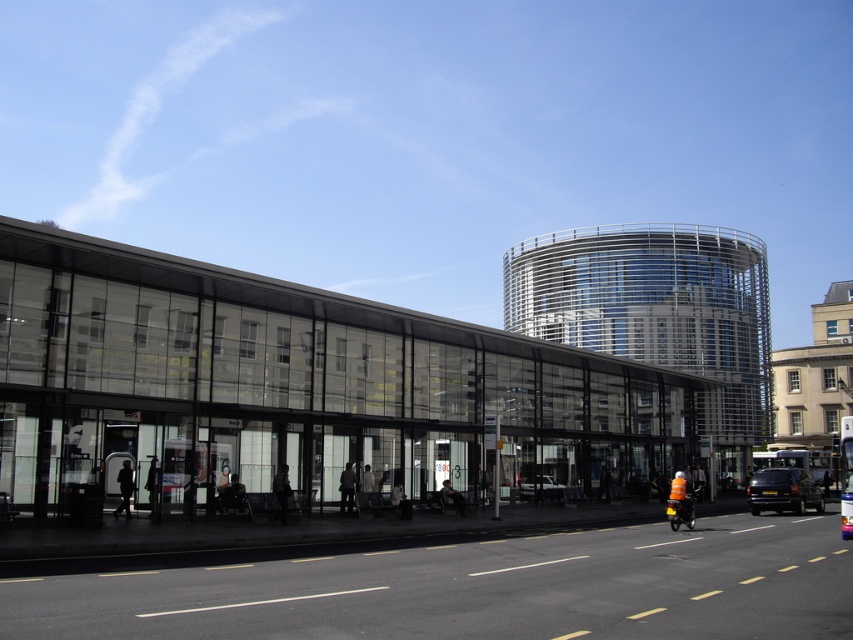
Question: Among these objects, which one is nearest to the camera?

Choices:
 (A) dark gray metallic car at center-right
 (B) white glossy car at center

Answer: (A)

Question: Observing the image, what is the correct spatial positioning of dark gray metallic car at center-right in reference to white glossy car at center?

Choices:
 (A) above
 (B) below

Answer: (B)

Question: Which of the following is the closest to the observer?

Choices:
 (A) (x=120, y=278)
 (B) (x=546, y=499)

Answer: (A)

Question: Which point is farther to the camera?

Choices:
 (A) blue metallic bus at center
 (B) dark gray metallic car at center-right
 (C) white glossy car at center

Answer: (C)

Question: Where is transparent glass bus station at center located in relation to white glossy car at center in the image?

Choices:
 (A) above
 (B) below

Answer: (A)

Question: Does blue metallic bus at center have a lesser width compared to white glossy car at center?

Choices:
 (A) no
 (B) yes

Answer: (A)